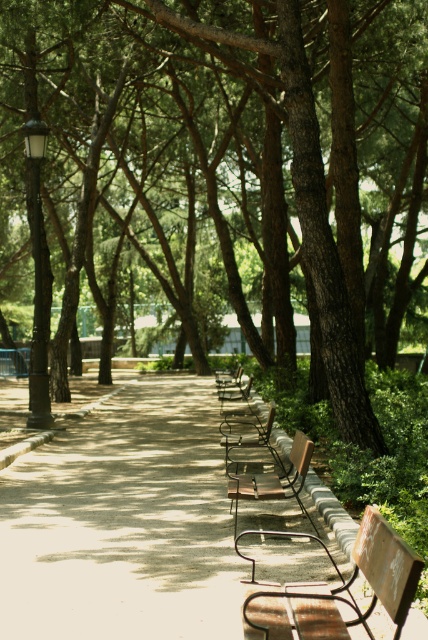
Can you confirm if smooth concrete pavement at center is smaller than metallic silver chair at center?

No.

What are the coordinates of `smooth concrete pavement at center` in the screenshot? It's located at click(x=124, y=524).

At what (x,y) coordinates should I click in order to perform the action: click on smooth concrete pavement at center. Please return your answer as a coordinate pair (x, y). The width and height of the screenshot is (428, 640). Looking at the image, I should click on (124, 524).

Who is more distant from viewer, (86, 628) or (220, 410)?

Positioned behind is point (220, 410).

Is point (89, 570) in front of point (246, 394)?

Yes, point (89, 570) is closer to viewer.

Where is `smooth concrete pavement at center`? Image resolution: width=428 pixels, height=640 pixels. smooth concrete pavement at center is located at coordinates (124, 524).

Locate an element on the screen. The height and width of the screenshot is (640, 428). brown textured tree at center is located at coordinates (237, 154).

Is brown textured tree at center wider than metallic silver chair at center?

Yes, brown textured tree at center is wider than metallic silver chair at center.

Measure the distance between brown textured tree at center and camera.

They are 9.39 meters apart.

Image resolution: width=428 pixels, height=640 pixels. I want to click on brown textured tree at center, so click(237, 154).